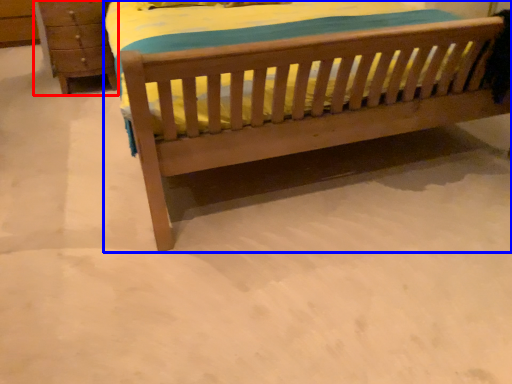
Question: Which of the following is the closest to the observer, chest of drawers (highlighted by a red box) or bed (highlighted by a blue box)?

Choices:
 (A) chest of drawers
 (B) bed

Answer: (B)